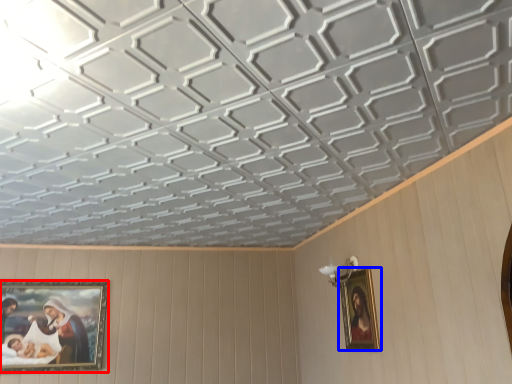
Question: Among these objects, which one is nearest to the camera, picture frame (highlighted by a red box) or picture frame (highlighted by a blue box)?

Choices:
 (A) picture frame
 (B) picture frame

Answer: (B)